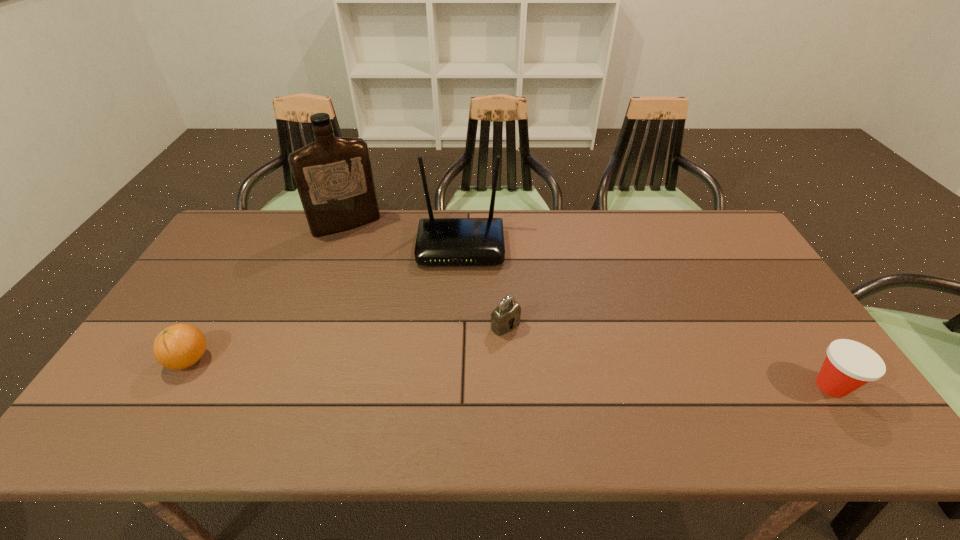
Locate an element on the screen. The height and width of the screenshot is (540, 960). vacant region located on the front-facing side of the router is located at coordinates (457, 355).

Image resolution: width=960 pixels, height=540 pixels. What are the coordinates of `vacant position located 0.100m at the front of the third farthest object near the keyhole` in the screenshot? It's located at (541, 358).

Where is `free space located at the front of the third farthest object near the keyhole`? This screenshot has height=540, width=960. free space located at the front of the third farthest object near the keyhole is located at coordinates (549, 366).

At what (x,y) coordinates should I click in order to perform the action: click on vacant area located at the front of the third farthest object near the keyhole. Please return your answer as a coordinate pair (x, y). The image size is (960, 540). Looking at the image, I should click on (530, 348).

The height and width of the screenshot is (540, 960). What are the coordinates of `free region located 0.380m on the label side of the tallest object` in the screenshot? It's located at (397, 309).

In order to click on free spot located on the label side of the tallest object in this screenshot , I will do `click(392, 298)`.

Image resolution: width=960 pixels, height=540 pixels. Find the location of `free spot located on the label side of the tallest object`. free spot located on the label side of the tallest object is located at coordinates (392, 298).

This screenshot has height=540, width=960. Find the location of `router that is at the far edge`. router that is at the far edge is located at coordinates (440, 241).

Identify the location of liquor that is at the far edge. The height and width of the screenshot is (540, 960). (x=333, y=175).

Image resolution: width=960 pixels, height=540 pixels. I want to click on orange that is positioned at the near edge, so click(179, 346).